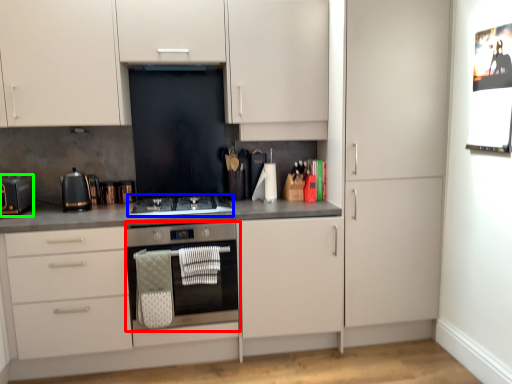
Question: Which is nearer to the home appliance (highlighted by a red box)? gas stove (highlighted by a blue box) or kitchen appliance (highlighted by a green box).

Choices:
 (A) gas stove
 (B) kitchen appliance

Answer: (A)